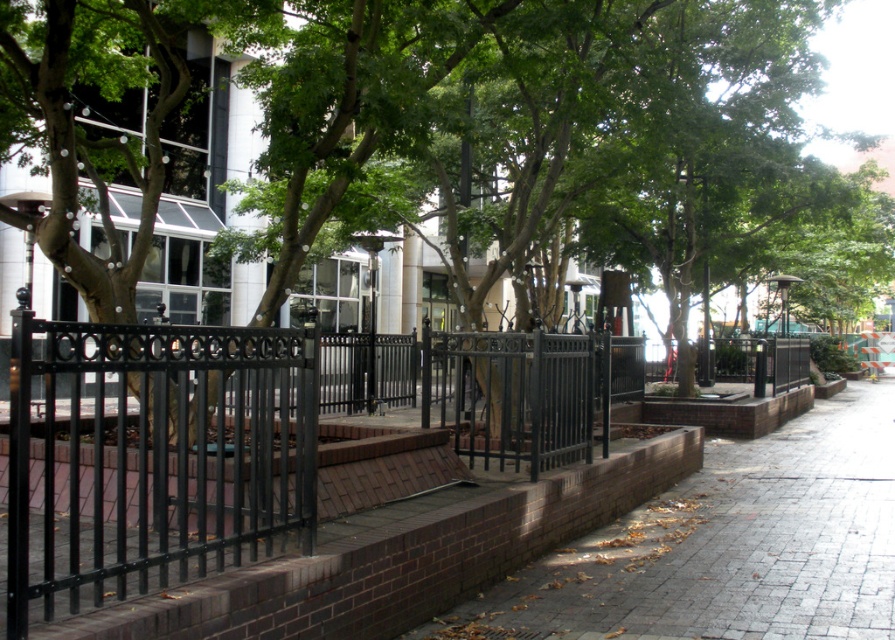
Can you confirm if black wrought iron fence at center is smaller than black wrought iron fence at left?

Yes, black wrought iron fence at center is smaller than black wrought iron fence at left.

The image size is (895, 640). Find the location of `black wrought iron fence at center`. black wrought iron fence at center is located at coordinates (155, 454).

Is point (19, 413) positioned behind point (278, 416)?

No, it is not.

The height and width of the screenshot is (640, 895). What are the coordinates of `black wrought iron fence at center` in the screenshot? It's located at (155, 454).

Which is above, green leafy tree at center or black wrought iron fence at left?

green leafy tree at center

Between green leafy tree at center and black wrought iron fence at left, which one appears on the right side from the viewer's perspective?

From the viewer's perspective, green leafy tree at center appears more on the right side.

Is point (405, 67) farther from viewer compared to point (304, 488)?

Yes, it is behind point (304, 488).

This screenshot has height=640, width=895. I want to click on green leafy tree at center, so click(278, 106).

Is point (169, 579) less distant than point (769, 563)?

Yes, it is in front of point (769, 563).

Can you confirm if black wrought iron fence at center is wider than brick pavement at center?

No, black wrought iron fence at center is not wider than brick pavement at center.

Where is `black wrought iron fence at center`? black wrought iron fence at center is located at coordinates (155, 454).

This screenshot has width=895, height=640. In order to click on black wrought iron fence at center in this screenshot , I will do `click(155, 454)`.